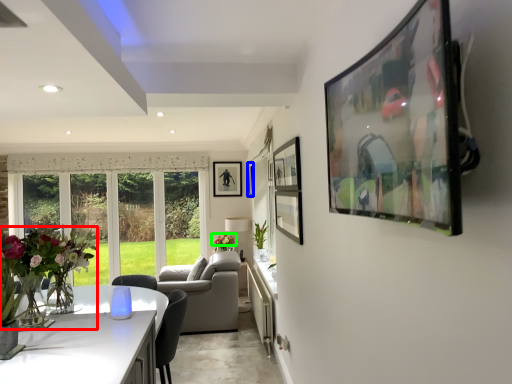
Question: Which object is the closest to the floral arrangement (highlighted by a red box)? Choose among these: picture frame (highlighted by a blue box) or flower (highlighted by a green box).

Choices:
 (A) picture frame
 (B) flower

Answer: (B)